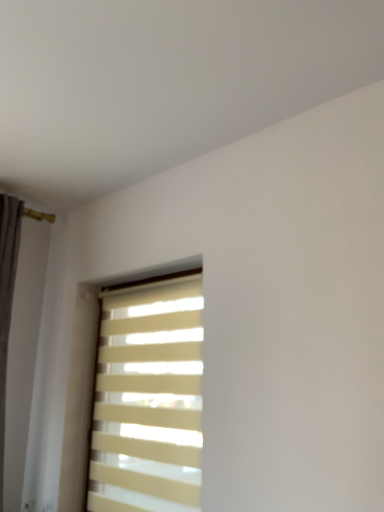
Measure the distance between beige fabric blinds at center and camera.

They are 5.21 feet apart.

I want to click on beige fabric blinds at center, so click(148, 398).

In order to face beige fabric blinds at center, should I rotate leftwards or rightwards?

It's best to rotate left around 6.795 degrees.

Describe the element at coordinates (148, 398) in the screenshot. I see `beige fabric blinds at center` at that location.

What do you see at coordinates (18, 333) in the screenshot?
I see `white matte shutter at left` at bounding box center [18, 333].

This screenshot has height=512, width=384. I want to click on white matte shutter at left, so click(18, 333).

Where is `beige fabric blinds at center`? The height and width of the screenshot is (512, 384). beige fabric blinds at center is located at coordinates (148, 398).

From the picture: Does white matte shutter at left appear on the left side of beige fabric blinds at center?

Yes.

Considering their positions, is white matte shutter at left located in front of or behind beige fabric blinds at center?

white matte shutter at left is positioned closer to the viewer than beige fabric blinds at center.

Which is in front, point (23, 283) or point (120, 399)?

The point (120, 399) is more forward.

From the image's perspective, which is above, white matte shutter at left or beige fabric blinds at center?

white matte shutter at left.

From a real-world perspective, is white matte shutter at left positioned over beige fabric blinds at center based on gravity?

Yes, from a real-world perspective, white matte shutter at left is on top of beige fabric blinds at center.

Which of these two, white matte shutter at left or beige fabric blinds at center, is thinner?

With smaller width is white matte shutter at left.

Is white matte shutter at left taller than beige fabric blinds at center?

Yes, white matte shutter at left is taller than beige fabric blinds at center.

Who is bigger, white matte shutter at left or beige fabric blinds at center?

white matte shutter at left is bigger.

Is white matte shutter at left outside of beige fabric blinds at center?

That's correct, white matte shutter at left is outside of beige fabric blinds at center.

Is white matte shutter at left in contact with beige fabric blinds at center?

No, white matte shutter at left is not beside beige fabric blinds at center.

Looking at this image, does white matte shutter at left turn towards beige fabric blinds at center?

No.

The width and height of the screenshot is (384, 512). What are the coordinates of `shutter in front of the beige fabric blinds at center` in the screenshot? It's located at (18, 333).

Is beige fabric blinds at center to the left of white matte shutter at left from the viewer's perspective?

Incorrect, beige fabric blinds at center is not on the left side of white matte shutter at left.

In the image, is beige fabric blinds at center positioned in front of or behind white matte shutter at left?

Visually, beige fabric blinds at center is located behind white matte shutter at left.

Between point (197, 462) and point (43, 273), which one is positioned behind?

Positioned behind is point (43, 273).

From the image's perspective, does beige fabric blinds at center appear lower than white matte shutter at left?

Yes, from the image's perspective, beige fabric blinds at center is below white matte shutter at left.

Consider the image. From a real-world perspective, is beige fabric blinds at center over white matte shutter at left?

No, from a real-world perspective, beige fabric blinds at center is not over white matte shutter at left

Is beige fabric blinds at center wider or thinner than white matte shutter at left?

Clearly, beige fabric blinds at center has more width compared to white matte shutter at left.

Who is taller, beige fabric blinds at center or white matte shutter at left?

white matte shutter at left is taller.

From the picture: Who is smaller, beige fabric blinds at center or white matte shutter at left?

With smaller size is beige fabric blinds at center.

Can we say beige fabric blinds at center lies outside white matte shutter at left?

beige fabric blinds at center lies outside white matte shutter at left's area.

Is beige fabric blinds at center with white matte shutter at left?

beige fabric blinds at center and white matte shutter at left are clearly separated.

Is beige fabric blinds at center oriented away from white matte shutter at left?

beige fabric blinds at center is not turned away from white matte shutter at left.

Can you tell me how much beige fabric blinds at center and white matte shutter at left differ in facing direction?

The angular difference between beige fabric blinds at center and white matte shutter at left is 1.88 degrees.

Identify the location of shutter in front of the beige fabric blinds at center. (18, 333).

Locate an element on the screen. The width and height of the screenshot is (384, 512). shutter above the beige fabric blinds at center (from the image's perspective) is located at coordinates (18, 333).

Locate an element on the screen. The width and height of the screenshot is (384, 512). window blind lying behind the white matte shutter at left is located at coordinates (148, 398).